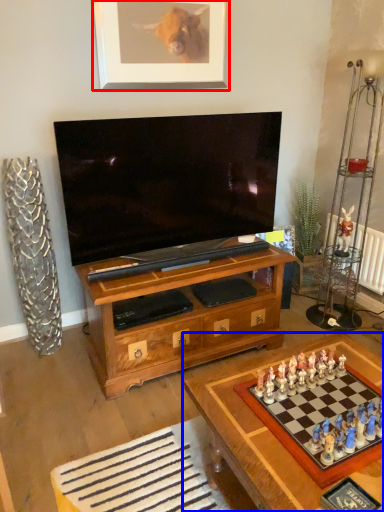
Question: Which point is further to the camera, picture frame (highlighted by a red box) or table (highlighted by a blue box)?

Choices:
 (A) picture frame
 (B) table

Answer: (A)